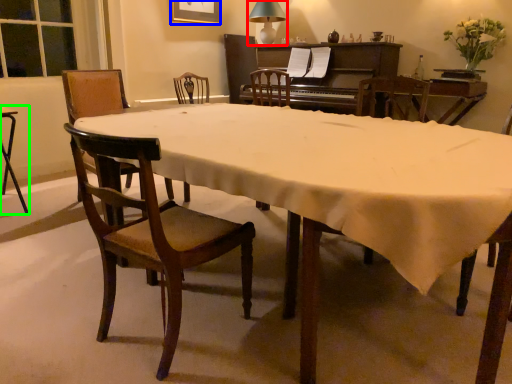
Question: Based on their relative distances, which object is farther from lamp (highlighted by a red box)? Choose from picture frame (highlighted by a blue box) and desk (highlighted by a green box).

Choices:
 (A) picture frame
 (B) desk

Answer: (B)